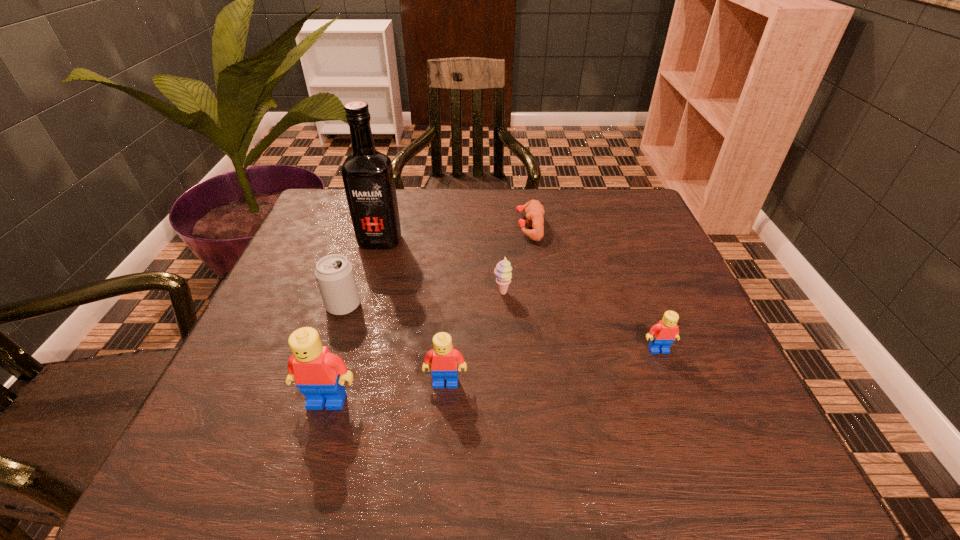
Identify the location of Lego that is at the left edge. This screenshot has width=960, height=540. (320, 375).

Find the location of a particular element. liquor located at the left edge is located at coordinates (367, 174).

The image size is (960, 540). I want to click on can located in the left edge section of the desktop, so click(x=334, y=273).

Find the location of `object located in the right edge section of the desktop`. object located in the right edge section of the desktop is located at coordinates (662, 335).

I want to click on object positioned at the far left corner, so click(367, 174).

At what (x,y) coordinates should I click in order to perform the action: click on object that is at the near left corner. Please return your answer as a coordinate pair (x, y). This screenshot has width=960, height=540. Looking at the image, I should click on (320, 375).

You are a GUI agent. You are given a task and a screenshot of the screen. Output one action in this format:
    pyautogui.click(x=<x>, y=<y>)
    Task: Click on the free spot at the far edge of the desktop
    
    Given the screenshot: What is the action you would take?
    pyautogui.click(x=406, y=199)

Find the location of a particular element. blank space at the left edge of the desktop is located at coordinates (242, 354).

In the image, there is a desktop. What are the coordinates of `vacant region at the right edge` in the screenshot? It's located at (625, 243).

I want to click on vacant area at the near left corner of the desktop, so click(286, 376).